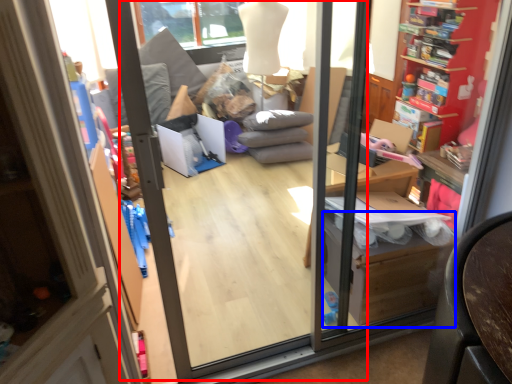
Question: Which point is further to the camera, screen door (highlighted by a red box) or cardboard box (highlighted by a blue box)?

Choices:
 (A) screen door
 (B) cardboard box

Answer: (B)